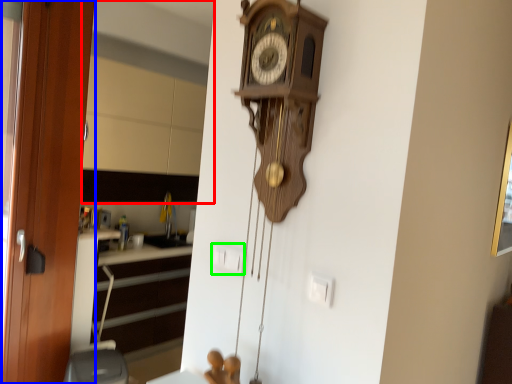
Question: Which is farther away from mirror (highlighted by a red box)? door (highlighted by a blue box) or electric outlet (highlighted by a green box)?

Choices:
 (A) door
 (B) electric outlet

Answer: (B)